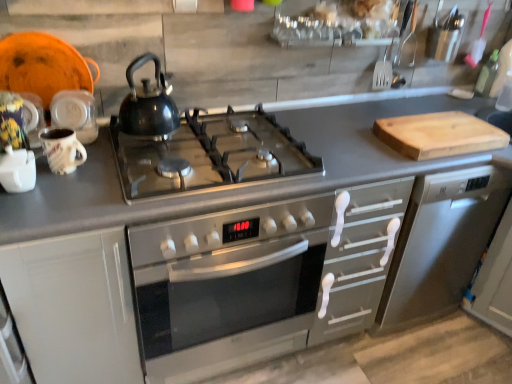
Question: Can you confirm if white matte cabinet at left is thinner than metallic stainless steel dishwasher at right?

Choices:
 (A) yes
 (B) no

Answer: (A)

Question: Is white matte cabinet at left touching metallic stainless steel dishwasher at right?

Choices:
 (A) no
 (B) yes

Answer: (A)

Question: From the image's perspective, is white matte cabinet at left below metallic stainless steel dishwasher at right?

Choices:
 (A) no
 (B) yes

Answer: (B)

Question: Considering the relative positions of white matte cabinet at left and metallic stainless steel dishwasher at right in the image provided, is white matte cabinet at left to the right of metallic stainless steel dishwasher at right from the viewer's perspective?

Choices:
 (A) yes
 (B) no

Answer: (B)

Question: Is white matte cabinet at left aimed at metallic stainless steel dishwasher at right?

Choices:
 (A) yes
 (B) no

Answer: (B)

Question: Is white matte cabinet at left turned away from metallic stainless steel dishwasher at right?

Choices:
 (A) no
 (B) yes

Answer: (A)

Question: Is matte ceramic mug at left outside of metallic stainless steel dishwasher at right?

Choices:
 (A) no
 (B) yes

Answer: (B)

Question: From the image's perspective, is matte ceramic mug at left above metallic stainless steel dishwasher at right?

Choices:
 (A) no
 (B) yes

Answer: (B)

Question: Is matte ceramic mug at left closer to camera compared to metallic stainless steel dishwasher at right?

Choices:
 (A) no
 (B) yes

Answer: (B)

Question: Can you confirm if matte ceramic mug at left is thinner than metallic stainless steel dishwasher at right?

Choices:
 (A) no
 (B) yes

Answer: (B)

Question: From a real-world perspective, is matte ceramic mug at left under metallic stainless steel dishwasher at right?

Choices:
 (A) yes
 (B) no

Answer: (B)

Question: Is matte ceramic mug at left smaller than metallic stainless steel dishwasher at right?

Choices:
 (A) yes
 (B) no

Answer: (A)

Question: Is green glass bottle at upper right bigger than glossy black kettle at center?

Choices:
 (A) yes
 (B) no

Answer: (B)